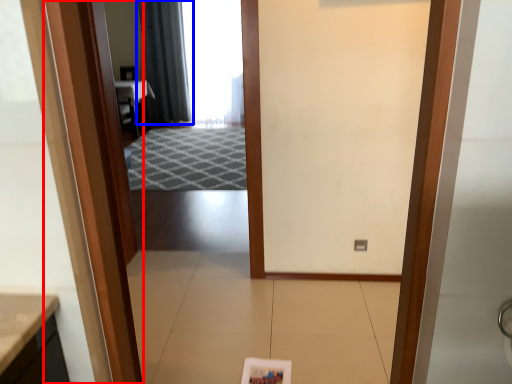
Question: Which of the following is the closest to the observer, door (highlighted by a red box) or curtain (highlighted by a blue box)?

Choices:
 (A) door
 (B) curtain

Answer: (A)